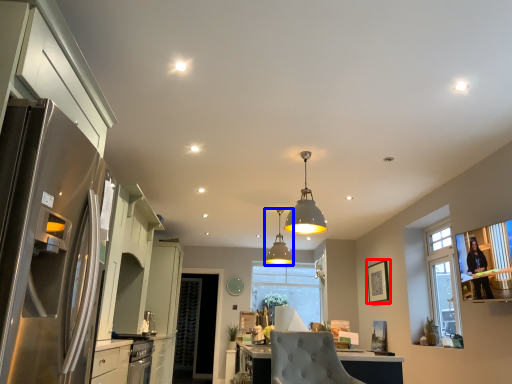
Question: Which object appears closest to the camera in this image, picture frame (highlighted by a red box) or lamp (highlighted by a blue box)?

Choices:
 (A) picture frame
 (B) lamp

Answer: (B)